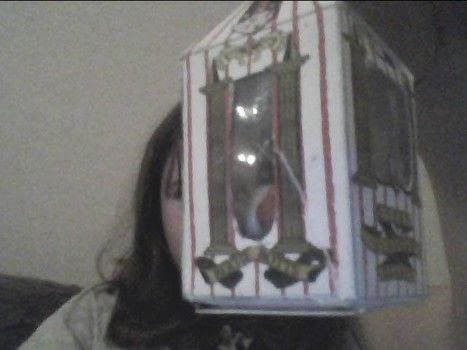
Locate an element on the screen. black couch is located at coordinates (42, 302).